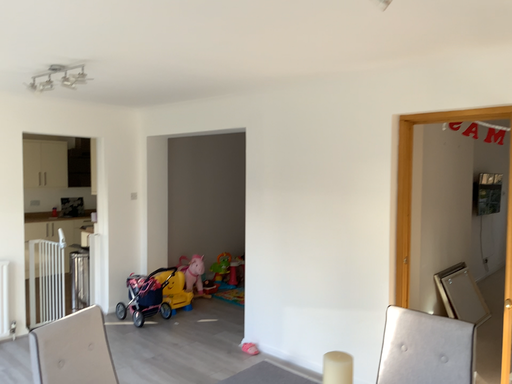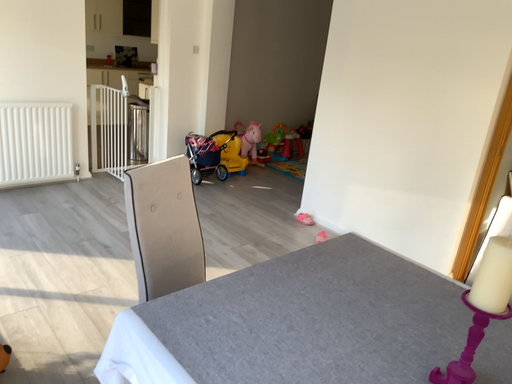
Question: How did the camera likely rotate when shooting the video?

Choices:
 (A) rotated upward
 (B) rotated downward

Answer: (B)